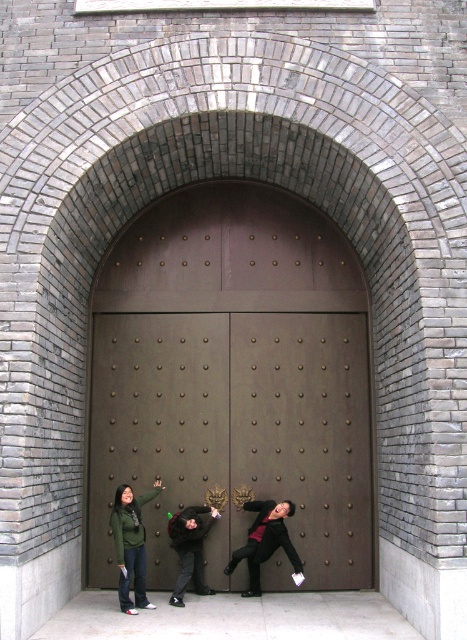
Question: Which of these objects is positioned farthest from the black leather jacket at lower center?

Choices:
 (A) brown polished wood door at center
 (B) dark gray fabric jacket at lower center

Answer: (A)

Question: Which is farther from the brown polished wood door at center?

Choices:
 (A) green matte jacket at lower left
 (B) dark gray fabric jacket at lower center
 (C) black leather jacket at lower center

Answer: (C)

Question: Is brown polished wood door at center below dark gray fabric jacket at lower center?

Choices:
 (A) yes
 (B) no

Answer: (B)

Question: Does green matte jacket at lower left come behind dark gray fabric jacket at lower center?

Choices:
 (A) no
 (B) yes

Answer: (A)

Question: Which of these objects is positioned closest to the green matte jacket at lower left?

Choices:
 (A) black leather jacket at lower center
 (B) brown polished wood door at center

Answer: (A)

Question: Can you confirm if brown polished wood door at center is bigger than green matte jacket at lower left?

Choices:
 (A) yes
 (B) no

Answer: (B)